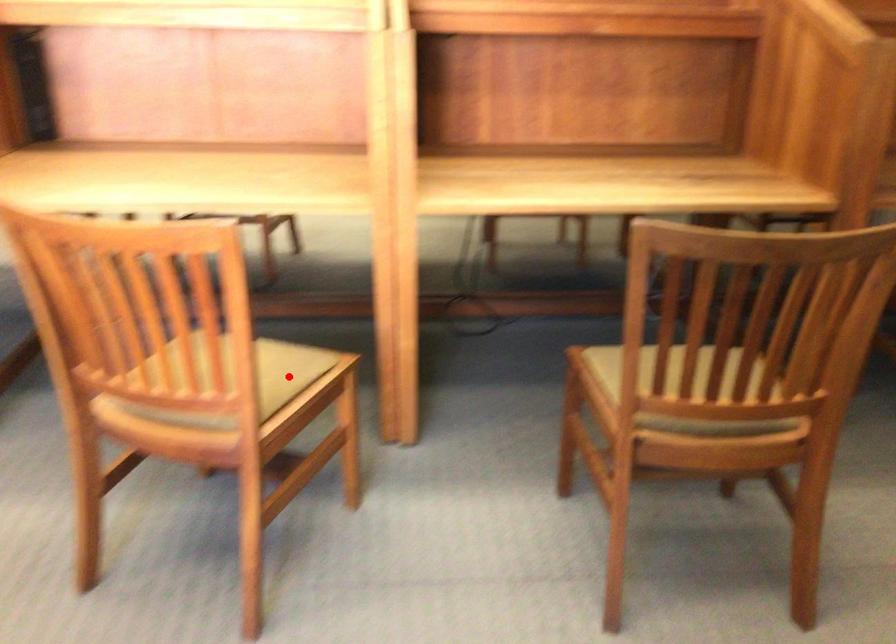
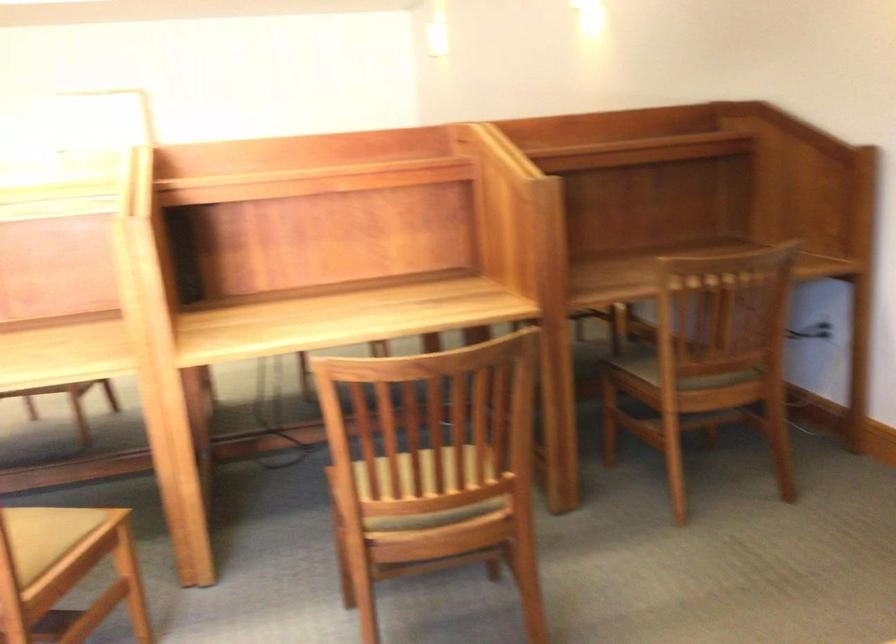
The point at the highlighted location is marked in the first image. Where is the corresponding point in the second image?

(62, 536)